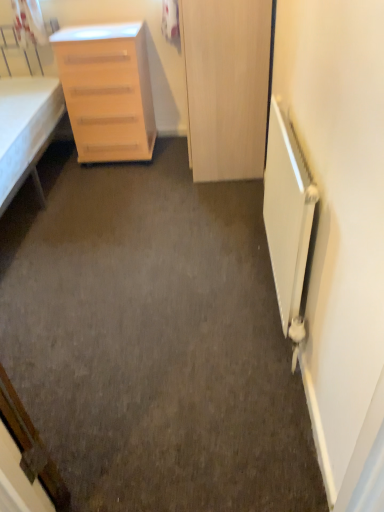
Question: Does wooden door at center have a lesser width compared to light wood/finely finished chest of drawers at left?

Choices:
 (A) yes
 (B) no

Answer: (A)

Question: Considering the relative sizes of wooden door at center and light wood/finely finished chest of drawers at left in the image provided, is wooden door at center taller than light wood/finely finished chest of drawers at left?

Choices:
 (A) no
 (B) yes

Answer: (B)

Question: From a real-world perspective, is wooden door at center located beneath light wood/finely finished chest of drawers at left?

Choices:
 (A) yes
 (B) no

Answer: (B)

Question: From the image's perspective, is wooden door at center located beneath light wood/finely finished chest of drawers at left?

Choices:
 (A) yes
 (B) no

Answer: (B)

Question: Can you confirm if wooden door at center is positioned to the left of light wood/finely finished chest of drawers at left?

Choices:
 (A) no
 (B) yes

Answer: (A)

Question: Considering the positions of point (9, 121) and point (296, 343), is point (9, 121) closer or farther from the camera than point (296, 343)?

Choices:
 (A) farther
 (B) closer

Answer: (A)

Question: Based on their sizes in the image, would you say white fabric bed at left is bigger or smaller than white matte radiator at right?

Choices:
 (A) small
 (B) big

Answer: (B)

Question: Considering the relative positions of white fabric bed at left and white matte radiator at right in the image provided, is white fabric bed at left to the left or to the right of white matte radiator at right?

Choices:
 (A) left
 (B) right

Answer: (A)

Question: From a real-world perspective, is white fabric bed at left physically located above or below white matte radiator at right?

Choices:
 (A) above
 (B) below

Answer: (A)

Question: Based on their positions, is white fabric bed at left located to the left or right of light wood/finely finished chest of drawers at left?

Choices:
 (A) left
 (B) right

Answer: (A)

Question: From a real-world perspective, is white fabric bed at left positioned above or below light wood/finely finished chest of drawers at left?

Choices:
 (A) above
 (B) below

Answer: (A)

Question: Considering the positions of white fabric bed at left and light wood/finely finished chest of drawers at left in the image, is white fabric bed at left wider or thinner than light wood/finely finished chest of drawers at left?

Choices:
 (A) wide
 (B) thin

Answer: (A)

Question: Relative to light wood/finely finished chest of drawers at left, is white fabric bed at left in front or behind?

Choices:
 (A) behind
 (B) front

Answer: (B)

Question: From a real-world perspective, is wooden door at center above or below white fabric bed at left?

Choices:
 (A) below
 (B) above

Answer: (B)

Question: Considering the relative positions of wooden door at center and white fabric bed at left in the image provided, is wooden door at center to the left or to the right of white fabric bed at left?

Choices:
 (A) right
 (B) left

Answer: (A)